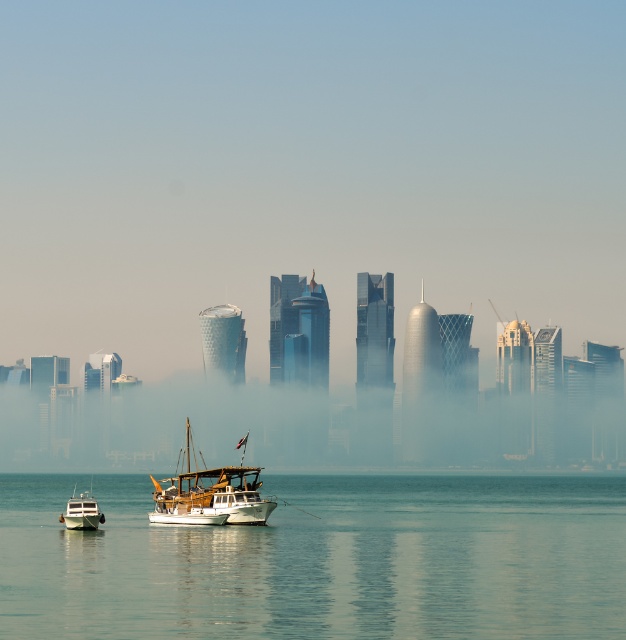
Is point (493, 628) farther from viewer compared to point (272, 504)?

Yes, it is behind point (272, 504).

Between point (116, 593) and point (148, 513), which one is positioned in front?

Point (148, 513)

In order to click on clear water at center in this screenshot , I will do `click(322, 561)`.

Does foggy glassy skyline at center appear under white wooden boat at lower left?

No, foggy glassy skyline at center is not below white wooden boat at lower left.

Does point (49, 444) lie behind point (69, 520)?

Yes, it is behind point (69, 520).

Where is `foggy glassy skyline at center`? Image resolution: width=626 pixels, height=640 pixels. foggy glassy skyline at center is located at coordinates tap(326, 404).

Which is more to the right, clear water at center or white wooden boat at lower left?

clear water at center is more to the right.

Which is more to the left, clear water at center or white wooden boat at lower left?

white wooden boat at lower left

Image resolution: width=626 pixels, height=640 pixels. Find the location of `clear water at center`. clear water at center is located at coordinates (322, 561).

You are a GUI agent. You are given a task and a screenshot of the screen. Output one action in this format:
    pyautogui.click(x=<x>, y=<y>)
    Task: Click on the clear water at center
    The image size is (626, 640).
    Given the screenshot: What is the action you would take?
    pyautogui.click(x=322, y=561)